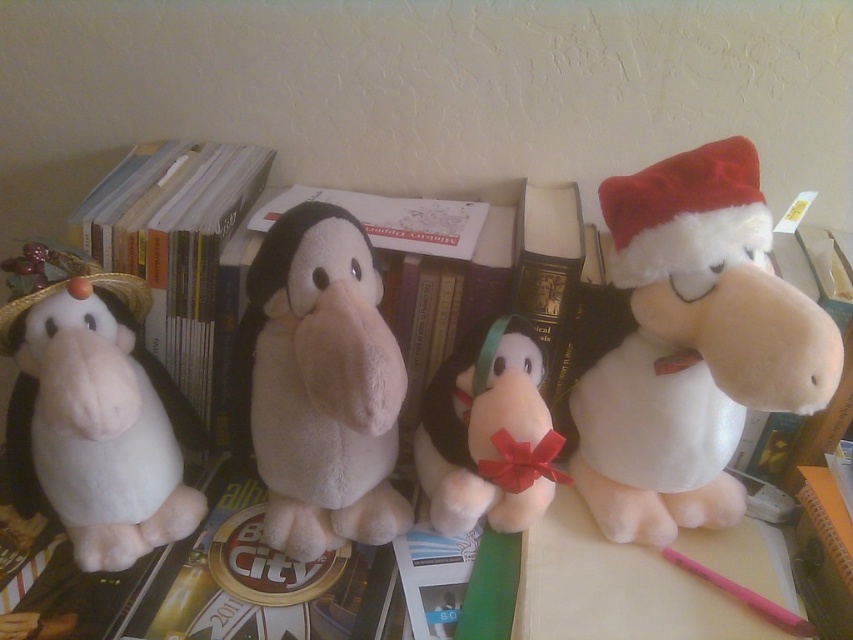
Which of these two, white plush hippo at left or white plush toy at center, stands shorter?

With less height is white plush toy at center.

Does white plush hippo at left have a smaller size compared to white plush toy at center?

Incorrect, white plush hippo at left is not smaller in size than white plush toy at center.

At what (x,y) coordinates should I click in order to perform the action: click on white plush hippo at left. Please return your answer as a coordinate pair (x, y). The height and width of the screenshot is (640, 853). Looking at the image, I should click on (93, 412).

Between point (691, 160) and point (143, 244), which one is positioned behind?

Positioned behind is point (143, 244).

Does white plush toy at upper right have a lesser height compared to white paper book at left?

No, white plush toy at upper right is not shorter than white paper book at left.

Is point (691, 525) less distant than point (170, 372)?

Yes.

Image resolution: width=853 pixels, height=640 pixels. Find the location of `white plush toy at upper right`. white plush toy at upper right is located at coordinates (689, 346).

Does white paper book at left appear on the right side of white plush toy at center?

In fact, white paper book at left is to the left of white plush toy at center.

Measure the distance between point (169, 196) and camera.

29.37 inches

Where is `white paper book at left`? Image resolution: width=853 pixels, height=640 pixels. white paper book at left is located at coordinates (173, 241).